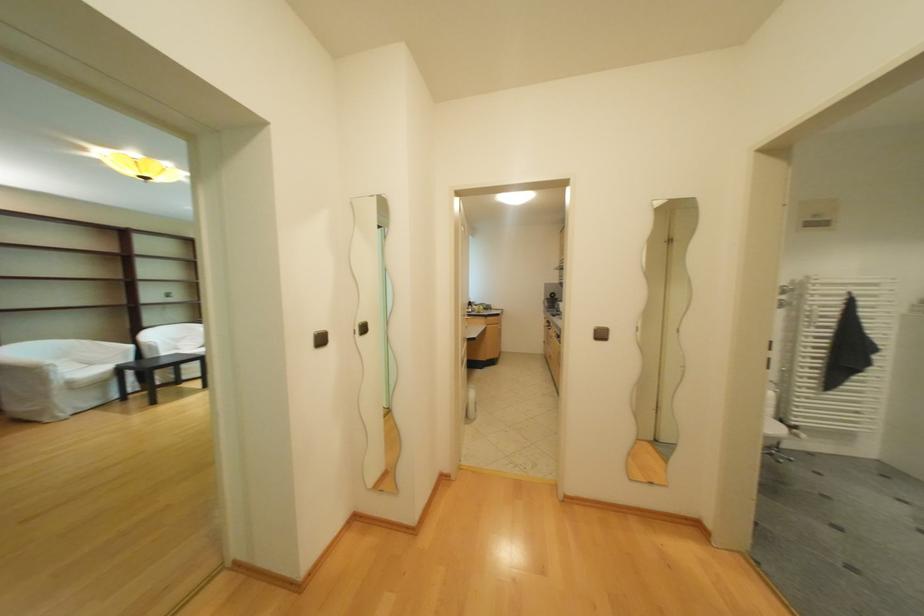
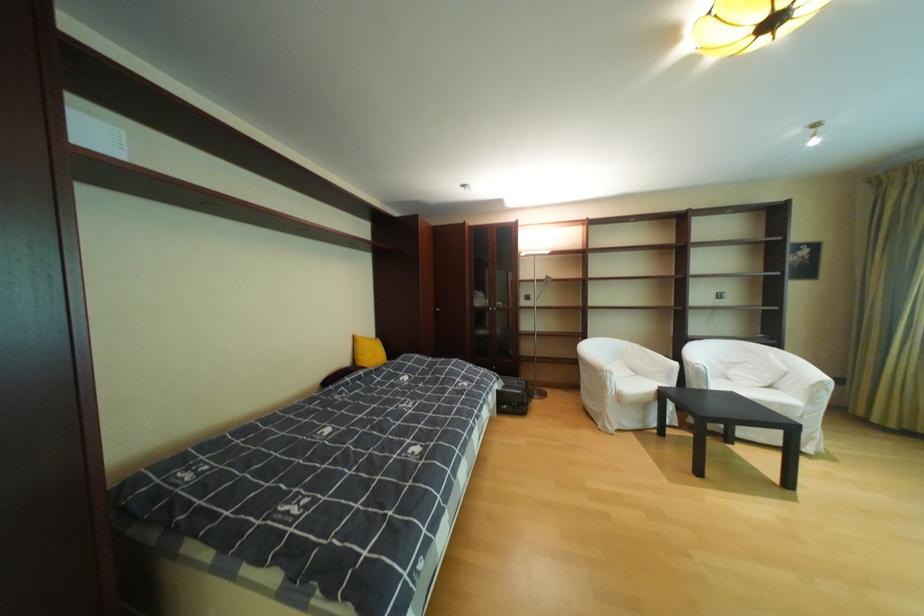
The point at (143,347) is marked in the first image. Where is the corresponding point in the second image?

(687, 365)